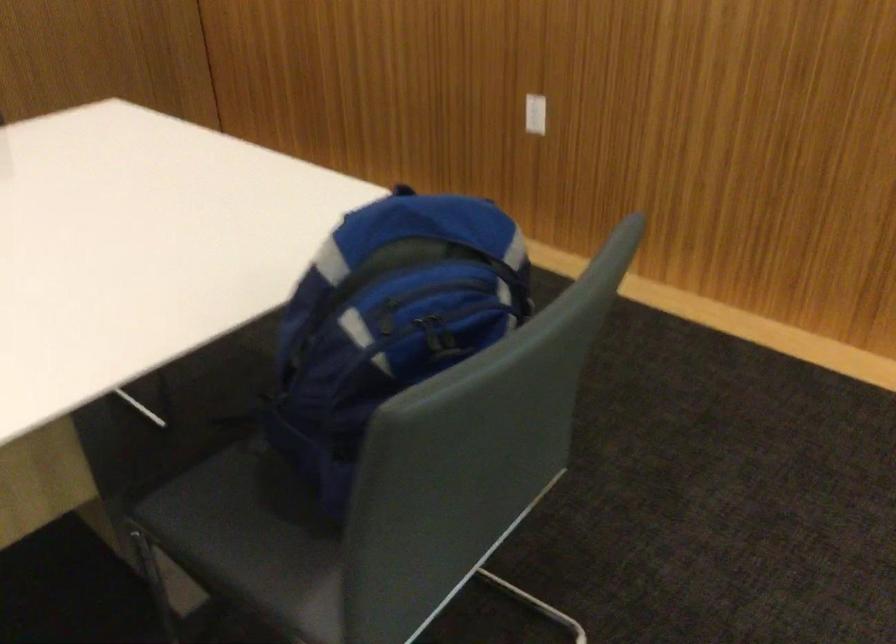
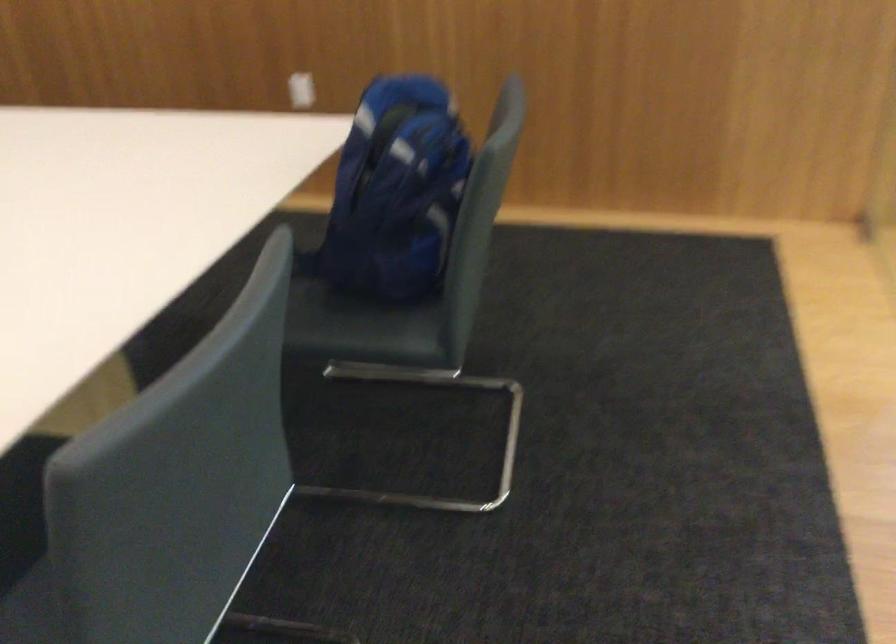
In the second image, find the point that corresponds to point (271, 491) in the first image.

(323, 308)